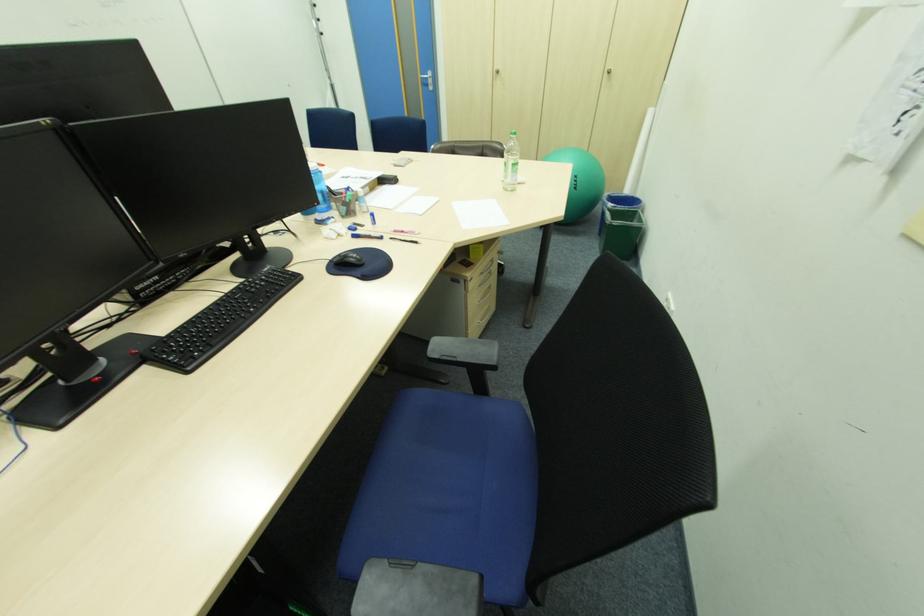
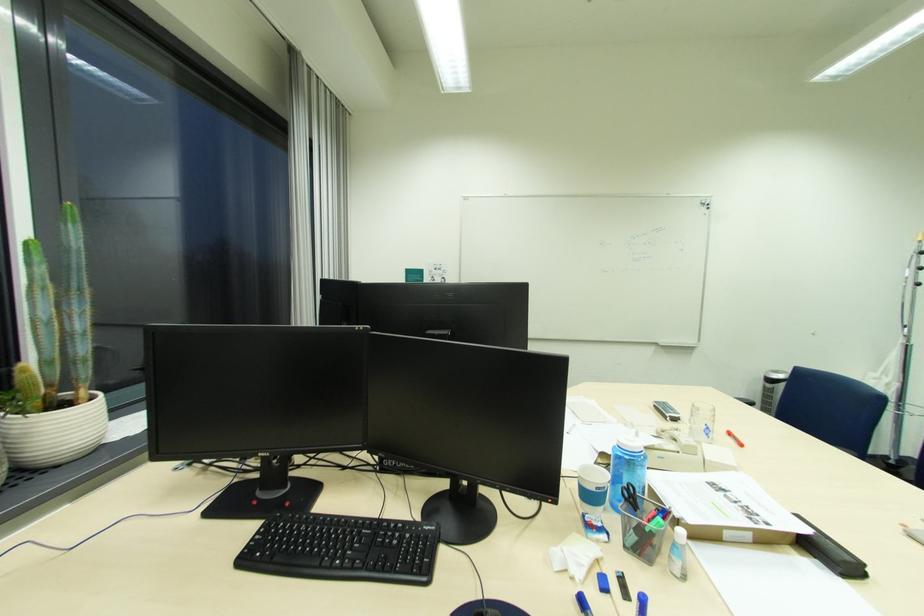
The point at (x=391, y=185) is marked in the first image. Where is the corresponding point in the second image?

(821, 557)